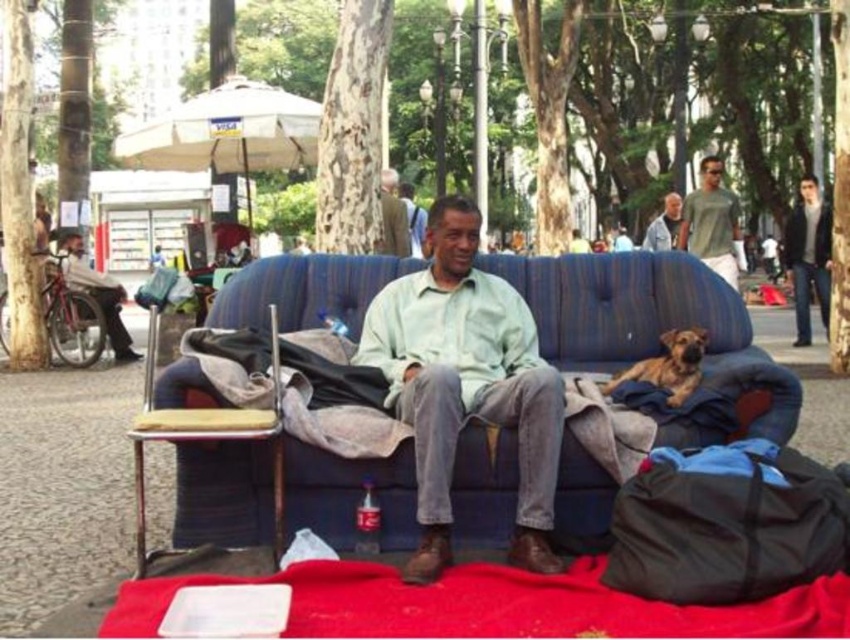
You are a passerby who wants to pick up the light brown leather jacket at center. Which direction should you move relative to the light brown leather jacket at left?

The light brown leather jacket at left is located below the light brown leather jacket at center. So, to reach the light brown leather jacket at center, you should move upwards from the light brown leather jacket at left.